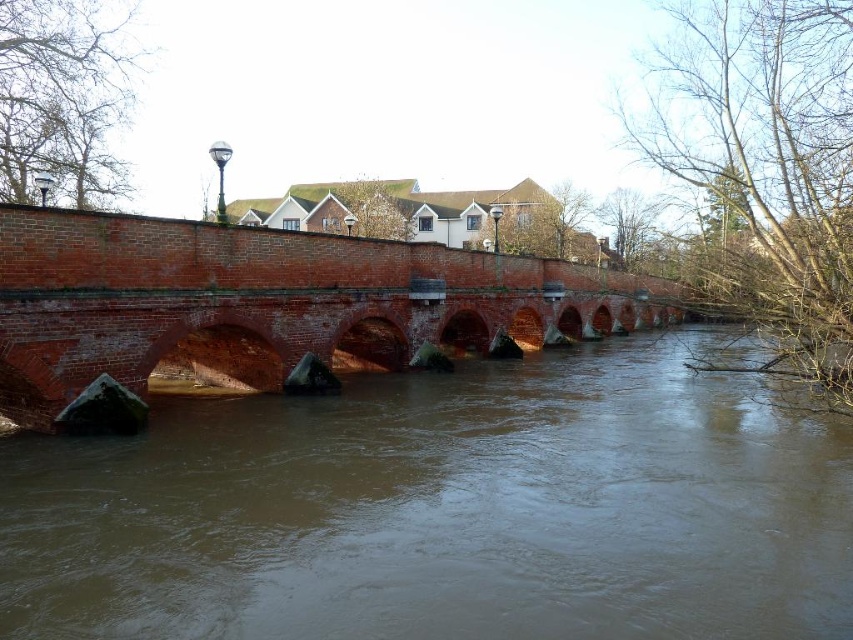
Question: Which point is farther to the camera?

Choices:
 (A) brick bridge at center
 (B) brown clay river at center

Answer: (A)

Question: Is the position of brown clay river at center more distant than that of brick bridge at center?

Choices:
 (A) yes
 (B) no

Answer: (B)

Question: Does brown clay river at center appear on the right side of brick bridge at center?

Choices:
 (A) no
 (B) yes

Answer: (B)

Question: Does brown clay river at center appear over brick bridge at center?

Choices:
 (A) no
 (B) yes

Answer: (A)

Question: Among these points, which one is nearest to the camera?

Choices:
 (A) (461, 481)
 (B) (485, 348)

Answer: (A)

Question: Which object is farther from the camera taking this photo?

Choices:
 (A) brick bridge at center
 (B) brown clay river at center

Answer: (A)